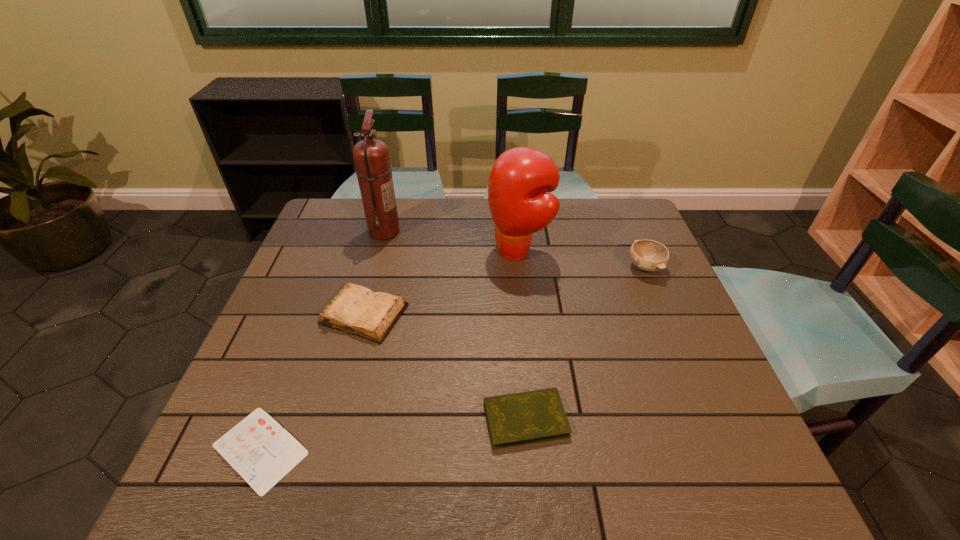
The width and height of the screenshot is (960, 540). Identify the location of fire extinguisher. click(371, 156).

Identify the location of boxing glove. The width and height of the screenshot is (960, 540). (520, 177).

Identify the location of the fourth shortest object. (648, 255).

Locate an element on the screen. The image size is (960, 540). bowl is located at coordinates (648, 255).

At what (x,y) coordinates should I click in order to perform the action: click on the fourth farthest object. Please return your answer as a coordinate pair (x, y). This screenshot has width=960, height=540. Looking at the image, I should click on (357, 310).

Identify the location of the farthest diary. (357, 310).

This screenshot has width=960, height=540. Find the location of `the second shortest diary`. the second shortest diary is located at coordinates (517, 419).

You are a GUI agent. You are given a task and a screenshot of the screen. Output one action in this format:
    pyautogui.click(x=<x>, y=<y>)
    Task: Click on the rightmost diary
    Image resolution: width=960 pixels, height=540 pixels.
    Given the screenshot: What is the action you would take?
    pyautogui.click(x=517, y=419)

Where is `the shortest diary`? The height and width of the screenshot is (540, 960). the shortest diary is located at coordinates (262, 452).

At what (x,y) coordinates should I click in order to perform the action: click on free spot located on the front-facing side of the fire extinguisher. Please return your answer as a coordinate pair (x, y). Looking at the image, I should click on (458, 231).